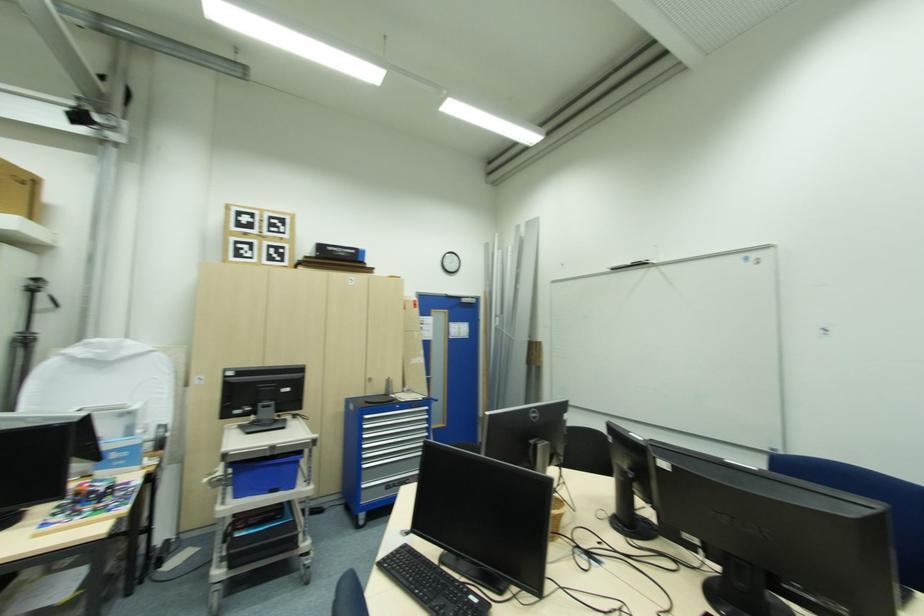
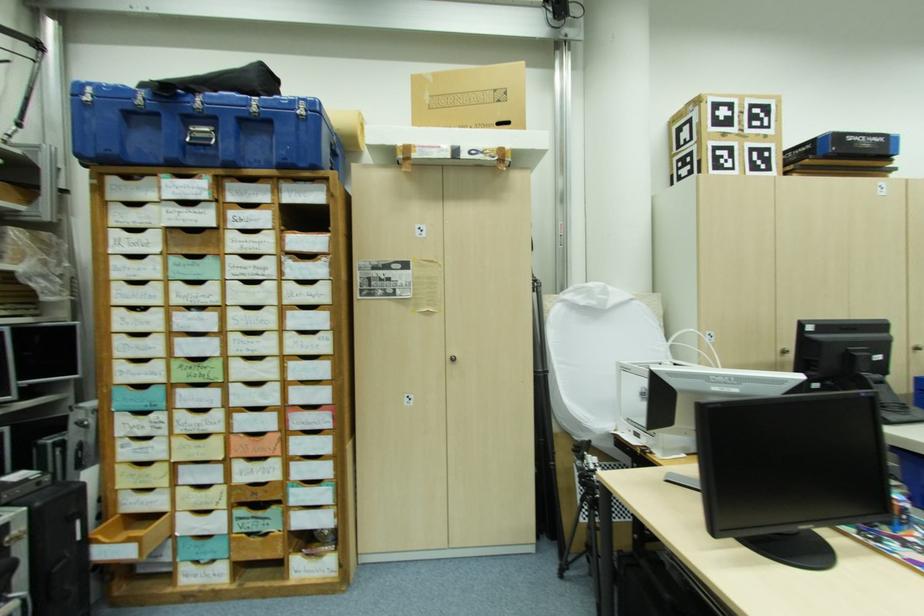
Question: In a continuous first-person perspective shot, in which direction is the camera moving?

Choices:
 (A) Left
 (B) Right
 (C) Forward
 (D) Backward

Answer: (A)